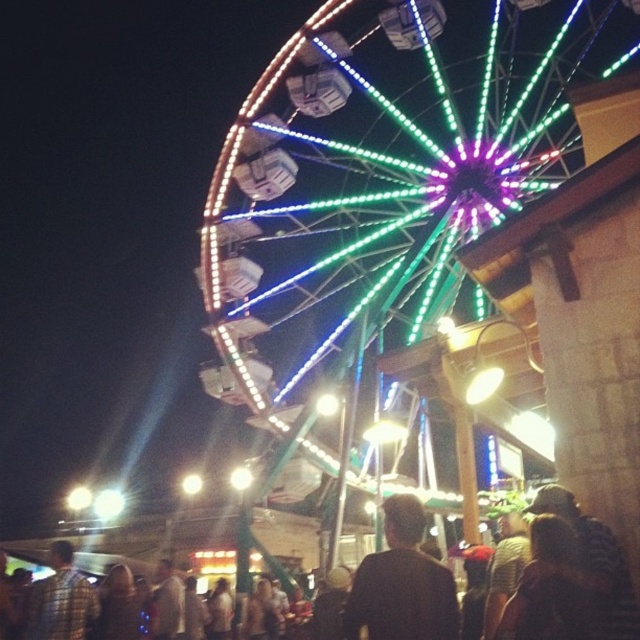
Question: Can you confirm if black matte shirt at center is positioned to the right of plaid shirt at lower left?

Choices:
 (A) yes
 (B) no

Answer: (A)

Question: Can you confirm if illuminated metal ferris wheel at upper center is positioned to the left of plaid shirt at lower left?

Choices:
 (A) yes
 (B) no

Answer: (B)

Question: Estimate the real-world distances between objects in this image. Which object is farther from the black matte shirt at center?

Choices:
 (A) plaid shirt at lower left
 (B) illuminated metal ferris wheel at upper center

Answer: (B)

Question: Among these points, which one is nearest to the camera?

Choices:
 (A) (28, 618)
 (B) (269, 147)

Answer: (A)

Question: Can you confirm if illuminated metal ferris wheel at upper center is bigger than black matte shirt at center?

Choices:
 (A) no
 (B) yes

Answer: (B)

Question: Which is nearer to the illuminated metal ferris wheel at upper center?

Choices:
 (A) black matte shirt at center
 (B) plaid shirt at lower left

Answer: (A)